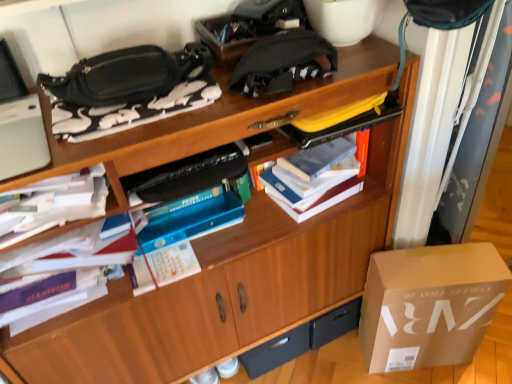
Where is `free point above hardcover book at center, the 4th book from the left (from a real-world perspective)`? free point above hardcover book at center, the 4th book from the left (from a real-world perspective) is located at coordinates (317, 155).